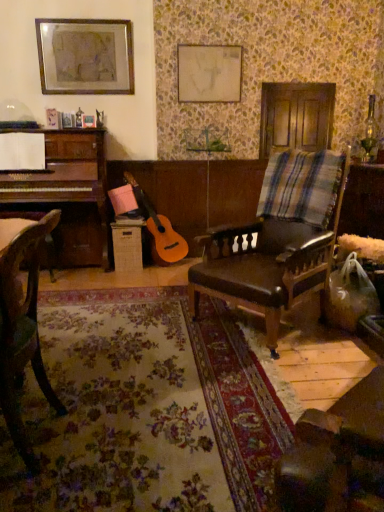
Question: Can you confirm if wooden chair at left, which is counted as the first chair, starting from the front, is shorter than matte white canvas at upper center, the 2th picture frame when ordered from left to right?

Choices:
 (A) no
 (B) yes

Answer: (A)

Question: From the image's perspective, does wooden chair at left, which is the 1th chair from left to right, appear lower than matte white canvas at upper center, the 2th picture frame when ordered from left to right?

Choices:
 (A) no
 (B) yes

Answer: (B)

Question: Are wooden chair at left, which is counted as the first chair, starting from the front, and matte white canvas at upper center, the 2th picture frame when ordered from left to right, making contact?

Choices:
 (A) no
 (B) yes

Answer: (A)

Question: Are wooden chair at left, the second chair viewed from the back, and matte white canvas at upper center, which appears as the 1th picture frame when viewed from the right, far apart?

Choices:
 (A) yes
 (B) no

Answer: (A)

Question: Is wooden chair at left, acting as the second chair starting from the right, bigger than matte white canvas at upper center, which appears as the 1th picture frame when viewed from the right?

Choices:
 (A) yes
 (B) no

Answer: (A)

Question: Is wooden chair at left, acting as the second chair starting from the right, at the left side of matte white canvas at upper center, which appears as the 1th picture frame when viewed from the right?

Choices:
 (A) yes
 (B) no

Answer: (A)

Question: From a real-world perspective, is matte white canvas at upper center, which appears as the 1th picture frame when viewed from the right, physically above metallic silver picture frame at upper left, the 2th picture frame viewed from the right?

Choices:
 (A) no
 (B) yes

Answer: (A)

Question: Does matte white canvas at upper center, which appears as the 1th picture frame when viewed from the right, turn towards metallic silver picture frame at upper left, the 2th picture frame viewed from the right?

Choices:
 (A) no
 (B) yes

Answer: (A)

Question: From the image's perspective, does matte white canvas at upper center, the 2th picture frame when ordered from left to right, appear higher than metallic silver picture frame at upper left, the 2th picture frame viewed from the right?

Choices:
 (A) yes
 (B) no

Answer: (B)

Question: From a real-world perspective, is matte white canvas at upper center, which appears as the 1th picture frame when viewed from the right, positioned under metallic silver picture frame at upper left, the 2th picture frame viewed from the right, based on gravity?

Choices:
 (A) yes
 (B) no

Answer: (A)

Question: From the image's perspective, is matte white canvas at upper center, which appears as the 1th picture frame when viewed from the right, beneath metallic silver picture frame at upper left, which ranks as the first picture frame in left-to-right order?

Choices:
 (A) yes
 (B) no

Answer: (A)

Question: Does matte white canvas at upper center, which appears as the 1th picture frame when viewed from the right, have a lesser height compared to metallic silver picture frame at upper left, which ranks as the first picture frame in left-to-right order?

Choices:
 (A) no
 (B) yes

Answer: (B)

Question: From the image's perspective, is matte white canvas at upper center, which appears as the 1th picture frame when viewed from the right, located above wooden chair at left, which is the 1th chair from left to right?

Choices:
 (A) no
 (B) yes

Answer: (B)